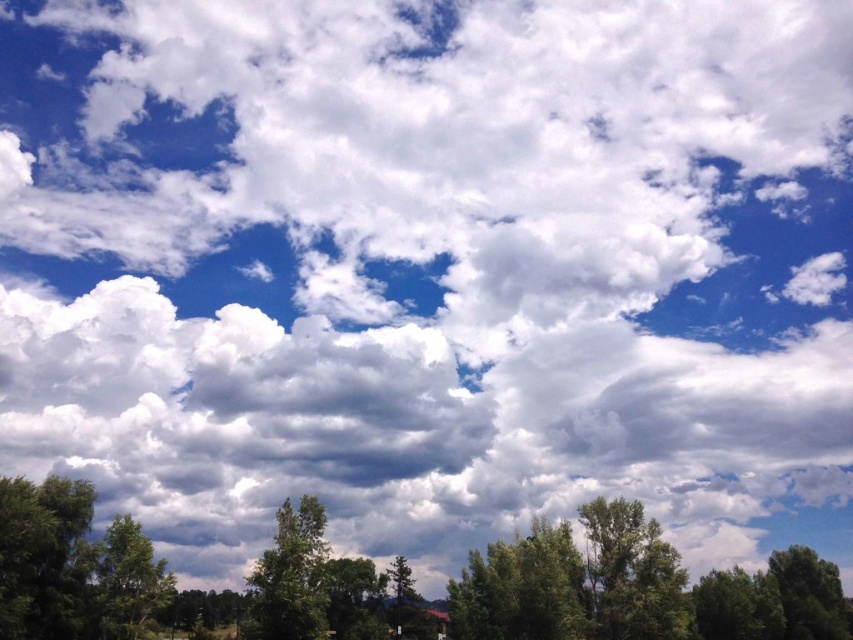
Question: Which object appears farthest from the camera in this image?

Choices:
 (A) green leafy tree at center
 (B) green leafy tree at lower left

Answer: (A)

Question: Among these objects, which one is nearest to the camera?

Choices:
 (A) green leafy tree at lower center
 (B) green leafy tree at lower left
 (C) green leafy tree at center

Answer: (A)

Question: Which point is closer to the camera?

Choices:
 (A) (309, 513)
 (B) (526, 637)

Answer: (A)

Question: Where is green leafy tree at lower center located in relation to green leafy tree at lower left in the image?

Choices:
 (A) left
 (B) right

Answer: (B)

Question: Can you confirm if green leafy tree at lower center is smaller than green leafy tree at center?

Choices:
 (A) yes
 (B) no

Answer: (B)

Question: Does green leafy tree at lower center appear on the left side of green leafy tree at center?

Choices:
 (A) no
 (B) yes

Answer: (A)